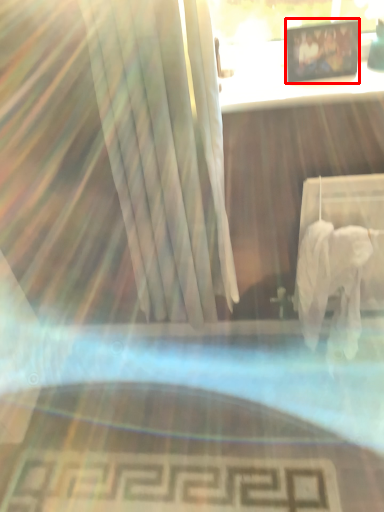
Question: Considering the relative positions of picture frame (annotated by the red box) and table in the image provided, where is picture frame (annotated by the red box) located with respect to the staircase?

Choices:
 (A) right
 (B) left

Answer: (A)